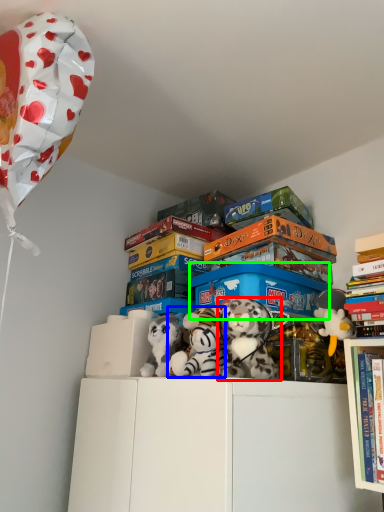
Question: Which object is the farthest from toy (highlighted by a red box)? Choose among these: toy (highlighted by a blue box) or storage box (highlighted by a green box).

Choices:
 (A) toy
 (B) storage box

Answer: (B)